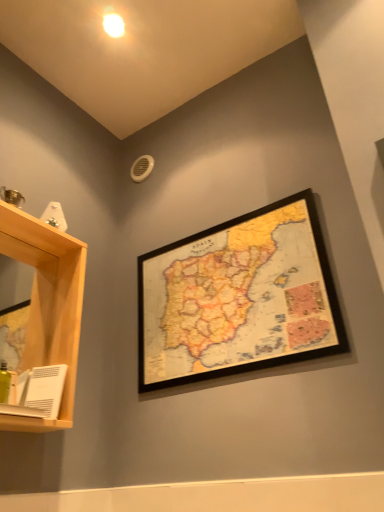
What is the approximate width of light wood shelf at left?

light wood shelf at left is 12.96 centimeters wide.

What do you see at coordinates (39, 392) in the screenshot? I see `white matte book at lower left` at bounding box center [39, 392].

Describe the element at coordinates (113, 25) in the screenshot. I see `white glossy light bulb at upper center` at that location.

Where is `wooden framed map at upper center`? The height and width of the screenshot is (512, 384). wooden framed map at upper center is located at coordinates (238, 298).

In order to click on light wood shelf at left in this screenshot , I will do `click(47, 304)`.

Consider the image. Considering the relative sizes of light wood shelf at left and white glossy light bulb at upper center in the image provided, is light wood shelf at left shorter than white glossy light bulb at upper center?

Incorrect, the height of light wood shelf at left does not fall short of that of white glossy light bulb at upper center.

Is light wood shelf at left oriented away from white glossy light bulb at upper center?

No, light wood shelf at left is not facing away from white glossy light bulb at upper center.

Which object is positioned more to the left, light wood shelf at left or white glossy light bulb at upper center?

From the viewer's perspective, light wood shelf at left appears more on the left side.

Which of these two, light wood shelf at left or white glossy light bulb at upper center, is bigger?

Bigger between the two is light wood shelf at left.

Is light wood shelf at left smaller than wooden framed map at upper center?

Incorrect, light wood shelf at left is not smaller in size than wooden framed map at upper center.

Is wooden framed map at upper center at the back of light wood shelf at left?

No, light wood shelf at left is not facing the opposite direction of wooden framed map at upper center.

From the image's perspective, is light wood shelf at left beneath wooden framed map at upper center?

Correct, light wood shelf at left appears lower than wooden framed map at upper center in the image.

Does light wood shelf at left have a lesser width compared to wooden framed map at upper center?

Incorrect, the width of light wood shelf at left is not less than that of wooden framed map at upper center.

Does point (118, 30) come farther from viewer compared to point (305, 197)?

Yes, point (118, 30) is behind point (305, 197).

Is white glossy light bulb at upper center taller than wooden framed map at upper center?

In fact, white glossy light bulb at upper center may be shorter than wooden framed map at upper center.

Measure the distance from white glossy light bulb at upper center to wooden framed map at upper center.

The distance of white glossy light bulb at upper center from wooden framed map at upper center is 1.10 meters.

Could you tell me if white glossy light bulb at upper center is facing wooden framed map at upper center?

No.

Is wooden framed map at upper center not within white matte book at lower left?

Yes, wooden framed map at upper center is outside of white matte book at lower left.

How much distance is there between wooden framed map at upper center and white matte book at lower left?

wooden framed map at upper center and white matte book at lower left are 22.06 inches apart.

Which object is further away from the camera taking this photo, wooden framed map at upper center or white matte book at lower left?

white matte book at lower left is further from the camera.

Consider the image. Is wooden framed map at upper center taller or shorter than white matte book at lower left?

wooden framed map at upper center is taller than white matte book at lower left.

Considering their positions, is white glossy light bulb at upper center located in front of or behind light wood shelf at left?

Clearly, white glossy light bulb at upper center is behind light wood shelf at left.

Could you tell me if white glossy light bulb at upper center is turned towards light wood shelf at left?

No, white glossy light bulb at upper center is not facing towards light wood shelf at left.

Can you see white glossy light bulb at upper center touching light wood shelf at left?

No, white glossy light bulb at upper center is not next to light wood shelf at left.

Between white glossy light bulb at upper center and light wood shelf at left, which one has less height?

With less height is white glossy light bulb at upper center.

Is wooden framed map at upper center next to white glossy light bulb at upper center and touching it?

No, wooden framed map at upper center is not next to white glossy light bulb at upper center.

Considering the sizes of wooden framed map at upper center and white glossy light bulb at upper center in the image, is wooden framed map at upper center wider or thinner than white glossy light bulb at upper center?

Clearly, wooden framed map at upper center has less width compared to white glossy light bulb at upper center.

Is wooden framed map at upper center oriented away from white glossy light bulb at upper center?

That's not correct — wooden framed map at upper center is not looking away from white glossy light bulb at upper center.

Does point (147, 308) come farther from viewer compared to point (112, 16)?

Yes, point (147, 308) is farther from viewer.

Is white glossy light bulb at upper center far away from white matte book at lower left?

Absolutely, white glossy light bulb at upper center is distant from white matte book at lower left.

Does white glossy light bulb at upper center have a lesser height compared to white matte book at lower left?

Indeed, white glossy light bulb at upper center has a lesser height compared to white matte book at lower left.

From the image's perspective, is white glossy light bulb at upper center on white matte book at lower left?

Yes.

You are a GUI agent. You are given a task and a screenshot of the screen. Output one action in this format:
    pyautogui.click(x=<x>, y=<y>)
    Task: Click on the light above the white matte book at lower left (from a real-world perspective)
    Image resolution: width=384 pixels, height=512 pixels.
    Given the screenshot: What is the action you would take?
    pyautogui.click(x=113, y=25)

Locate an element on the screen. The image size is (384, 512). light to the right of light wood shelf at left is located at coordinates (113, 25).

Find the location of `shelf in front of the wooden framed map at upper center`. shelf in front of the wooden framed map at upper center is located at coordinates coord(47,304).

From the image, which object appears to be nearer to white glossy light bulb at upper center, light wood shelf at left or white matte book at lower left?

light wood shelf at left lies closer to white glossy light bulb at upper center than the other object.

Looking at the image, which one is located further to light wood shelf at left, white matte book at lower left or white glossy light bulb at upper center?

Among the two, white glossy light bulb at upper center is located further to light wood shelf at left.

Looking at the image, which one is located further to white matte book at lower left, white glossy light bulb at upper center or light wood shelf at left?

The object further to white matte book at lower left is white glossy light bulb at upper center.

Looking at the image, which one is located further to light wood shelf at left, white glossy light bulb at upper center or white matte book at lower left?

Among the two, white glossy light bulb at upper center is located further to light wood shelf at left.

Considering their positions, is white matte book at lower left positioned closer to wooden framed map at upper center than white glossy light bulb at upper center?

white matte book at lower left lies closer to wooden framed map at upper center than the other object.

Which object lies nearer to the anchor point light wood shelf at left, wooden framed map at upper center or white glossy light bulb at upper center?

wooden framed map at upper center is closer to light wood shelf at left.

When comparing their distances from white matte book at lower left, does wooden framed map at upper center or light wood shelf at left seem further?

Based on the image, wooden framed map at upper center appears to be further to white matte book at lower left.

From the image, which object appears to be farther from light wood shelf at left, white glossy light bulb at upper center or wooden framed map at upper center?

white glossy light bulb at upper center lies further to light wood shelf at left than the other object.

Identify the location of picture frame between white glossy light bulb at upper center and light wood shelf at left in the vertical direction. (238, 298).

Find the location of `shelf between white glossy light bulb at upper center and white matte book at lower left in the vertical direction`. shelf between white glossy light bulb at upper center and white matte book at lower left in the vertical direction is located at coordinates (47, 304).

Where is `book between light wood shelf at left and wooden framed map at upper center in the horizontal direction`? This screenshot has width=384, height=512. book between light wood shelf at left and wooden framed map at upper center in the horizontal direction is located at coordinates (39, 392).

Identify the location of picture frame between white glossy light bulb at upper center and white matte book at lower left vertically. (238, 298).